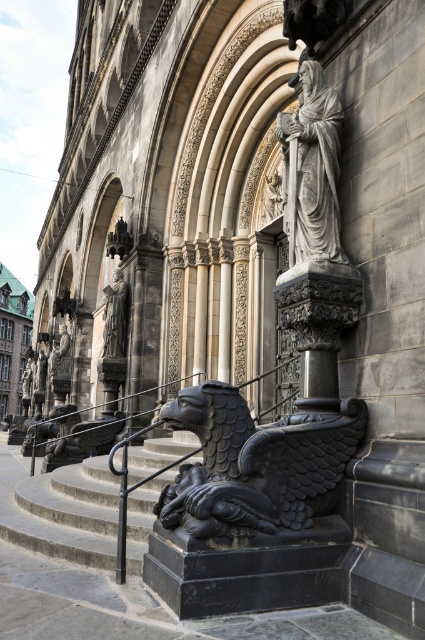
You are a visitor approaching the grand stone building and want to reach the entrance. You see the black stone stairs at lower left and the matte gray statue at center. Which object takes up more space in the scene?

The matte gray statue at center takes up more space in the scene than the black stone stairs at lower left.

You are standing in front of the grand stone building and notice two statues. The first is a black stone gargoyle at center, and the second is a matte gray statue at center. From your perspective, which statue is positioned to the right?

The black stone gargoyle at center is positioned to the right of the matte gray statue at center.